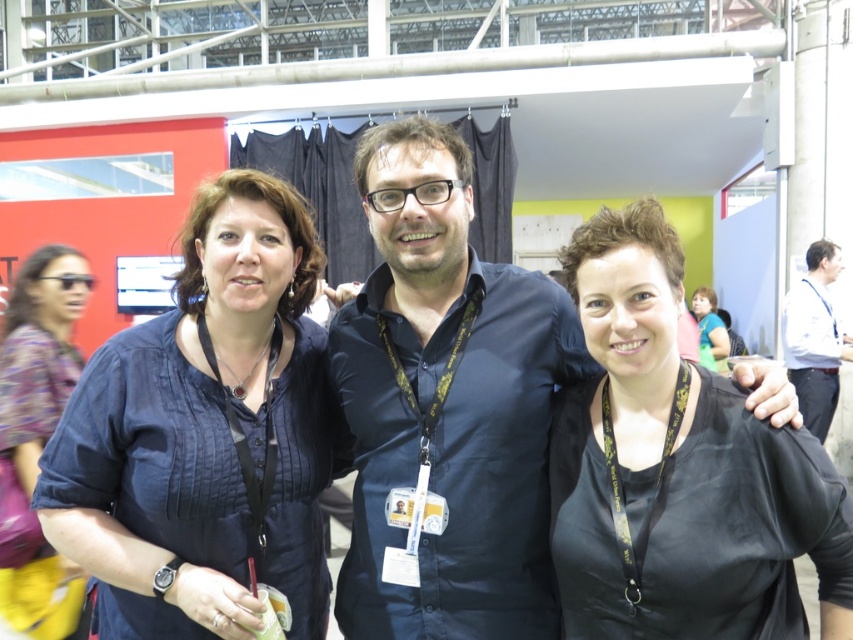
You are an event photographer trying to capture a clear shot of both the matte blue blouse at center and the dark blue shirt at center. Since you can only focus on one clothing item at a time, which one should you focus on to ensure the other is still in the background?

The matte blue blouse at center is below dark blue shirt at center, so focusing on the dark blue shirt at center would keep the matte blue blouse at center in the background.

You are standing in the large hall and notice two clothing items at the center of the image. The dark blue shirt at center and the black silk blouse at center. Which clothing item is positioned higher?

The dark blue shirt at center is positioned higher than the black silk blouse at center.

You are a photographer at the event and need to adjust the lighting so that both the black silk blouse at center and the white shirt at right are evenly lit. Based on their positions, which one might require more light adjustment?

The black silk blouse at center is below the white shirt at right. Since the white shirt at right is higher up, it might receive more ambient light from the ceiling fixtures, so the black silk blouse at center may need more light adjustment to balance the exposure.